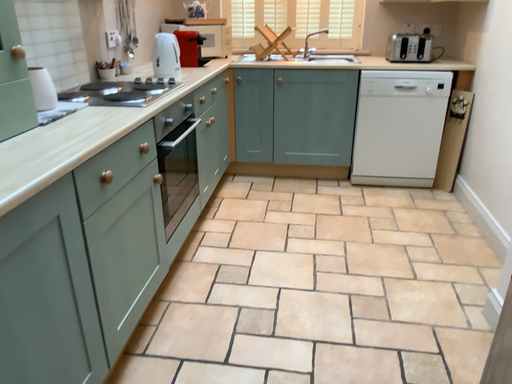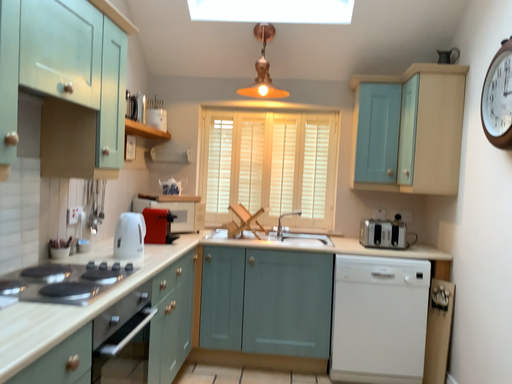
Question: Which way did the camera rotate in the video?

Choices:
 (A) rotated downward
 (B) rotated upward

Answer: (B)